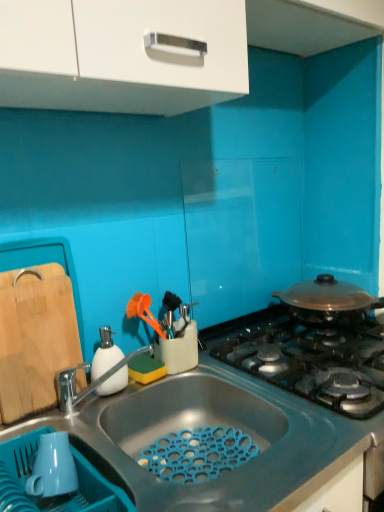
Question: In terms of size, does natural wood cutting board at left appear bigger or smaller than blue matte sink at lower center?

Choices:
 (A) big
 (B) small

Answer: (B)

Question: Is natural wood cutting board at left inside or outside of blue matte sink at lower center?

Choices:
 (A) inside
 (B) outside

Answer: (B)

Question: Based on their relative distances, which object is nearer to the white glossy cabinet at upper center?

Choices:
 (A) blue matte sink at lower center
 (B) silver metallic tap at sink left
 (C) white matte soap dispenser at left
 (D) natural wood cutting board at left

Answer: (D)

Question: Based on their relative distances, which object is nearer to the natural wood cutting board at left?

Choices:
 (A) white matte soap dispenser at left
 (B) blue matte sink at lower center
 (C) white glossy cabinet at upper center
 (D) silver metallic tap at sink left

Answer: (D)